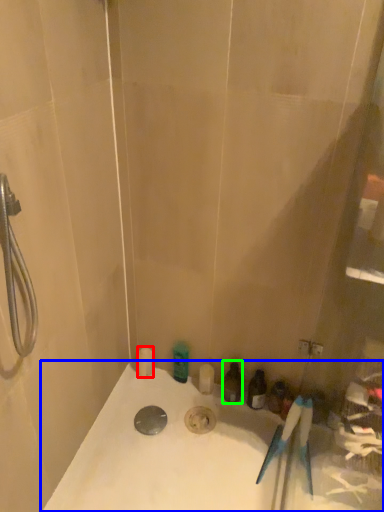
Question: Which object is positioned farthest from toiletry (highlighted by a red box)? Select from bathtub (highlighted by a blue box) and toiletry (highlighted by a green box).

Choices:
 (A) bathtub
 (B) toiletry

Answer: (A)